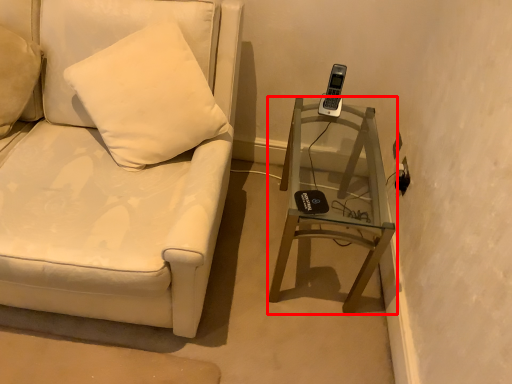
Question: Where is table (annotated by the red box) located in relation to furniture in the image?

Choices:
 (A) left
 (B) right

Answer: (B)